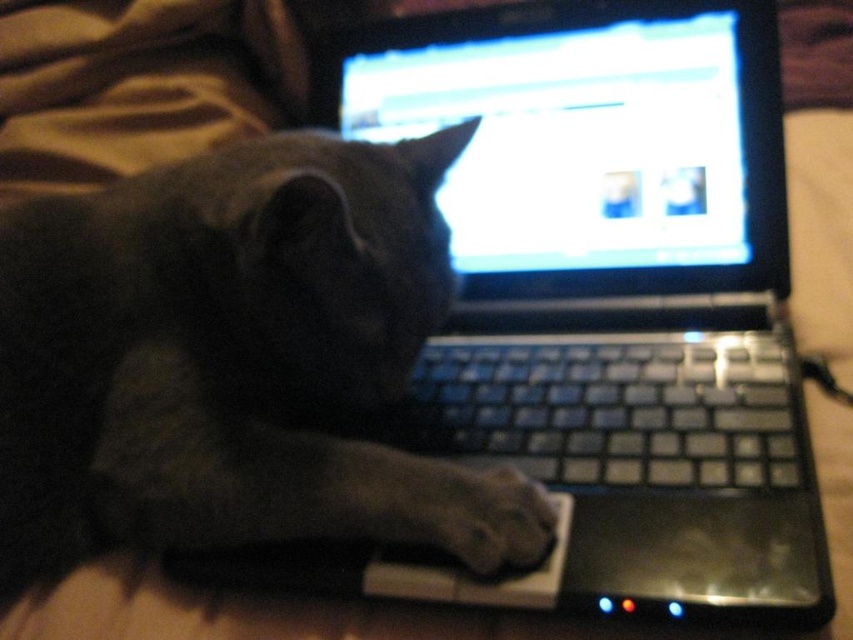
Question: Which of these objects is positioned closest to the dark gray fur cat at center?

Choices:
 (A) black plastic laptop at center
 (B) gray fur paw at lower center

Answer: (A)

Question: Among these objects, which one is nearest to the camera?

Choices:
 (A) dark gray fur cat at center
 (B) black plastic laptop at center

Answer: (B)

Question: Is dark gray fur cat at center smaller than black plastic keyboard at center?

Choices:
 (A) yes
 (B) no

Answer: (B)

Question: Is dark gray fur cat at center wider than gray fur paw at lower center?

Choices:
 (A) yes
 (B) no

Answer: (A)

Question: Among these points, which one is farthest from the camera?

Choices:
 (A) (485, 442)
 (B) (718, 60)
 (C) (33, 435)

Answer: (B)

Question: Can you confirm if dark gray fur cat at center is smaller than gray fur paw at lower center?

Choices:
 (A) no
 (B) yes

Answer: (A)